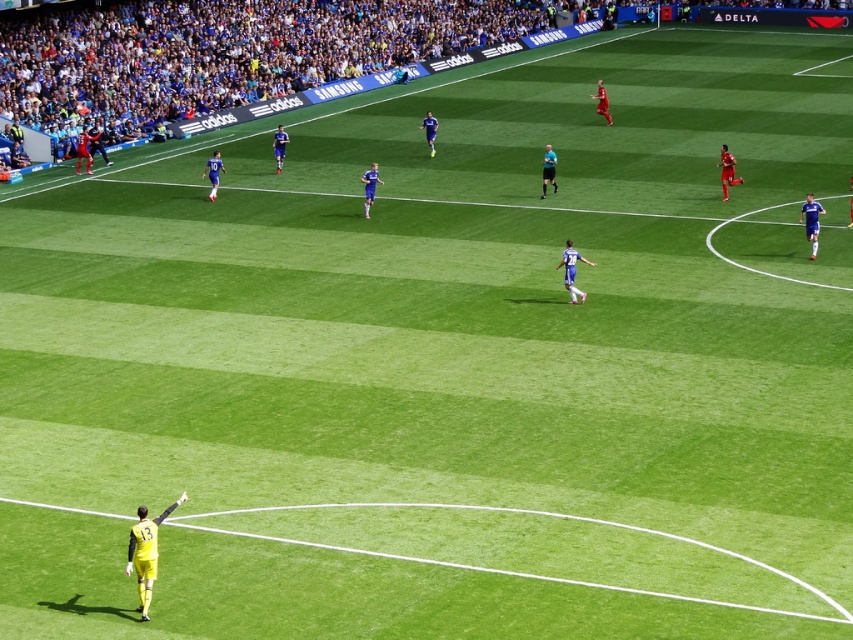
Question: Can you confirm if blue jersey at right is positioned above black uniform at center?

Choices:
 (A) yes
 (B) no

Answer: (B)

Question: Among these points, which one is nearest to the camera?

Choices:
 (A) (432, 115)
 (B) (210, 195)
 (C) (726, 164)

Answer: (C)

Question: Is blue jersey at right to the right of blue jersey at center from the viewer's perspective?

Choices:
 (A) no
 (B) yes

Answer: (B)

Question: Which object is the farthest from the white jersey at center?

Choices:
 (A) blue fabric jersey at upper left
 (B) red matte jersey at upper right
 (C) red jersey at upper right

Answer: (C)

Question: Which of the following is the closest to the observer?

Choices:
 (A) (372, 186)
 (B) (606, 122)
 (C) (86, 164)

Answer: (A)

Question: Observing the image, what is the correct spatial positioning of white jersey at center in reference to blue jersey at center?

Choices:
 (A) above
 (B) below

Answer: (B)